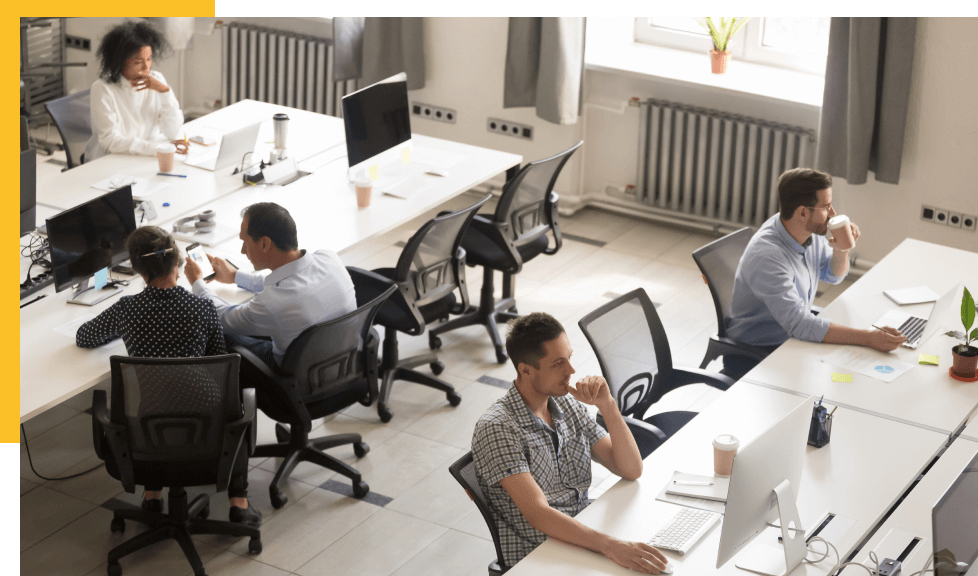
Identify the location of computer screen. This screenshot has height=576, width=978. (28, 170), (100, 219), (391, 101), (754, 475), (939, 308), (238, 141).